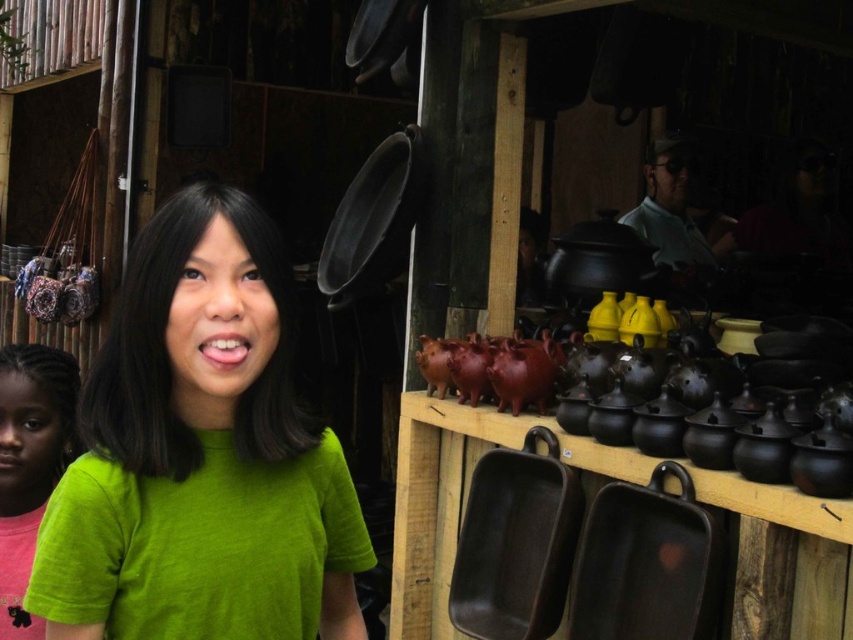
Is green fabric shirt at center taller than green matte shirt at left?

Indeed, green fabric shirt at center has a greater height compared to green matte shirt at left.

Can you confirm if green fabric shirt at center is smaller than green matte shirt at left?

Yes.

Between point (229, 500) and point (36, 346), which one is positioned in front?

Point (229, 500)

Find the location of a particular element. green fabric shirt at center is located at coordinates (201, 454).